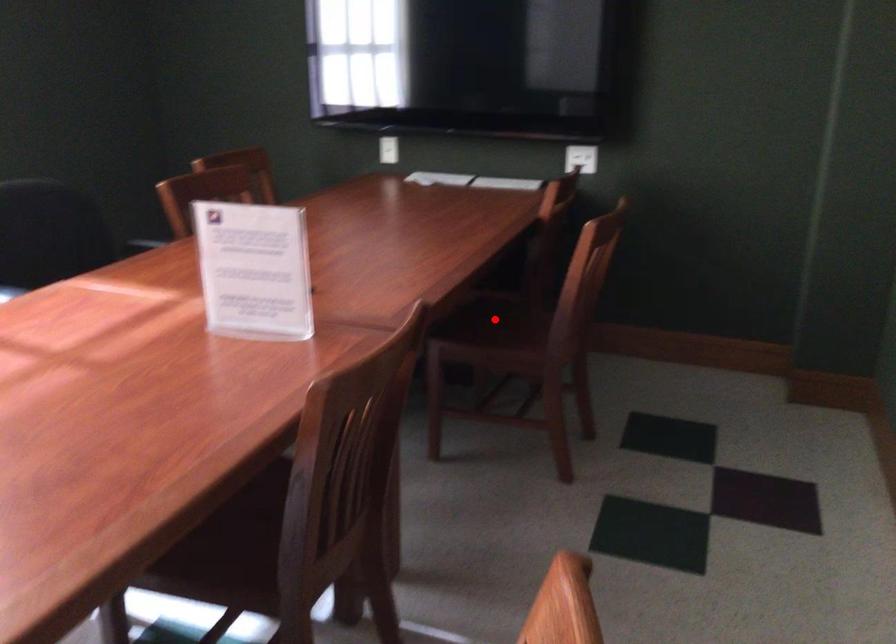
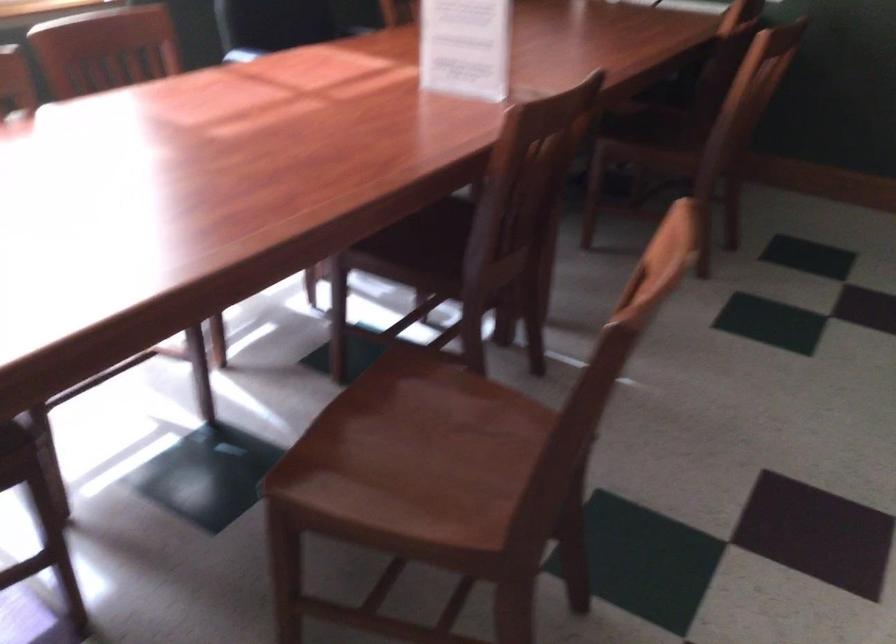
Where in the second image is the point corresponding to the highlighted location from the first image?

(659, 122)